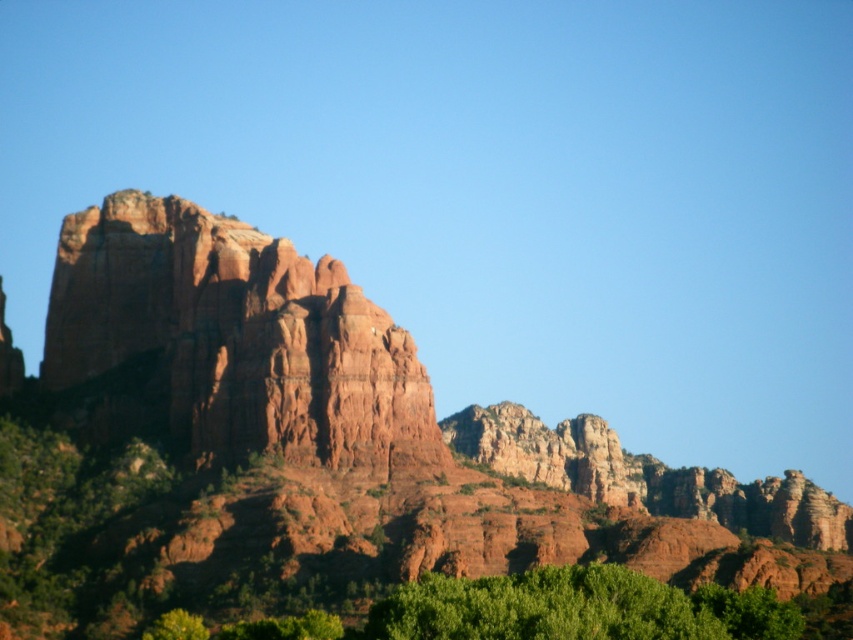
Does rustic rock formation at center appear on the left side of reddish-brown rock formation at center-left?

Incorrect, rustic rock formation at center is not on the left side of reddish-brown rock formation at center-left.

Is point (299, 604) closer to camera compared to point (247, 237)?

Yes, point (299, 604) is in front of point (247, 237).

The image size is (853, 640). Describe the element at coordinates (316, 449) in the screenshot. I see `rustic rock formation at center` at that location.

Locate an element on the screen. This screenshot has height=640, width=853. rustic rock formation at center is located at coordinates (316, 449).